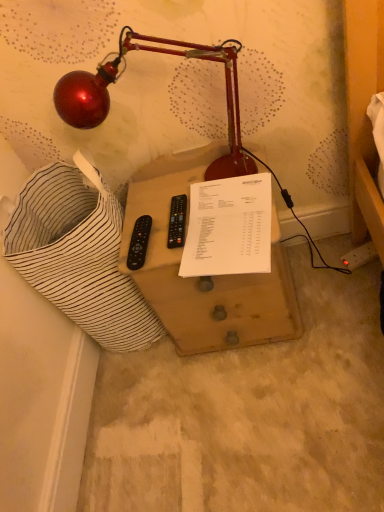
Find the location of `vacant space in front of wooden drawer at center`. vacant space in front of wooden drawer at center is located at coordinates (274, 404).